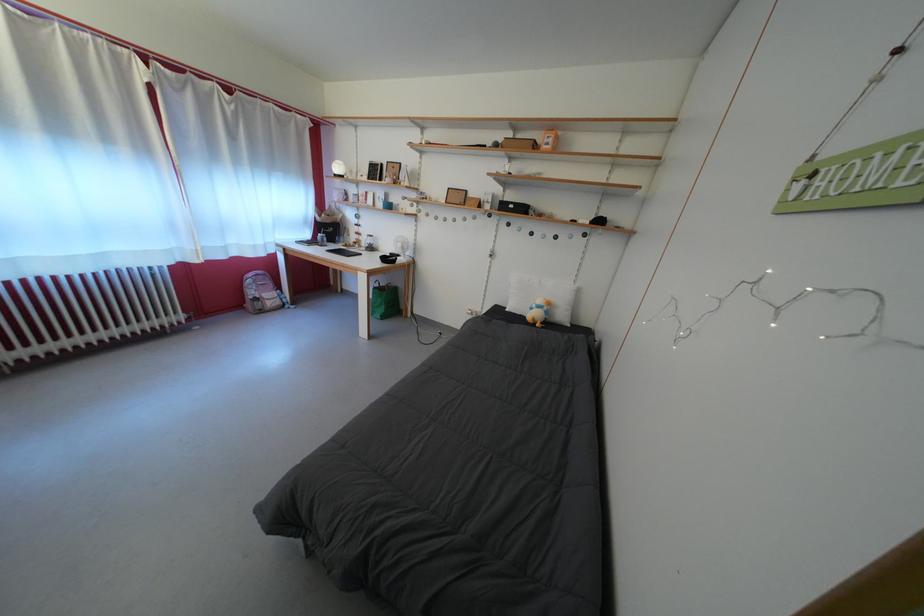
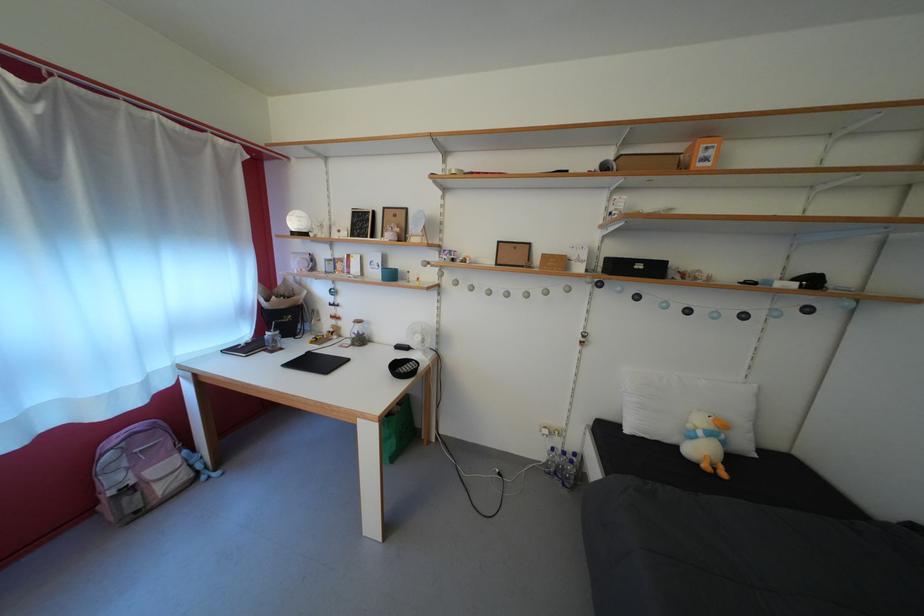
Find the pixel in the second image that matches point 388,211 in the first image.

(383, 280)